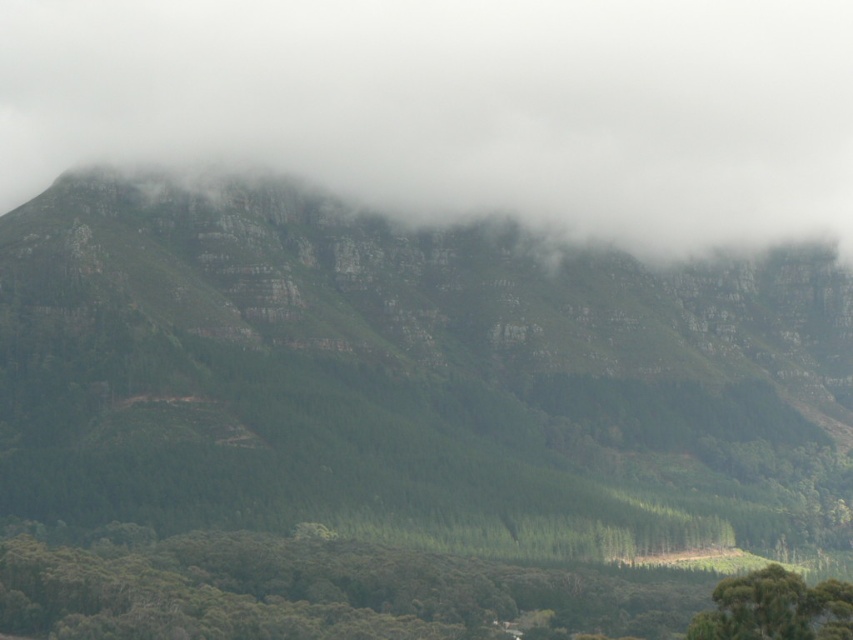
Question: Does white fluffy cloud at upper center have a lesser width compared to green leafy tree at lower right?

Choices:
 (A) yes
 (B) no

Answer: (B)

Question: Which of these objects is positioned farthest from the white fluffy cloud at upper center?

Choices:
 (A) green matte forest at lower center
 (B) green textured mountain at center
 (C) green leafy tree at lower right

Answer: (C)

Question: Can you confirm if green textured mountain at center is positioned to the left of green leafy tree at lower right?

Choices:
 (A) yes
 (B) no

Answer: (A)

Question: Can you confirm if white fluffy cloud at upper center is wider than green matte forest at lower center?

Choices:
 (A) no
 (B) yes

Answer: (B)

Question: Considering the real-world distances, which object is farthest from the white fluffy cloud at upper center?

Choices:
 (A) green textured mountain at center
 (B) green leafy tree at lower right

Answer: (B)

Question: Which of the following is the closest to the observer?

Choices:
 (A) green matte forest at lower center
 (B) green leafy tree at lower right
 (C) green textured mountain at center
 (D) white fluffy cloud at upper center

Answer: (B)